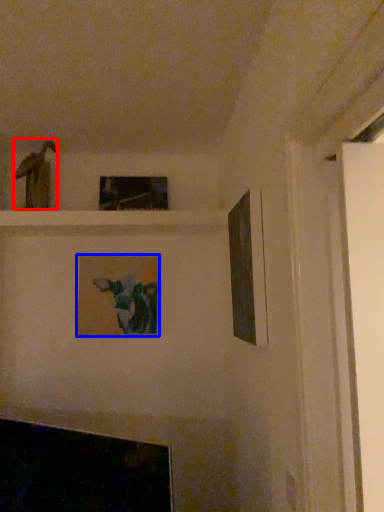
Question: Which point is further to the camera, art (highlighted by a red box) or picture frame (highlighted by a blue box)?

Choices:
 (A) art
 (B) picture frame

Answer: (B)